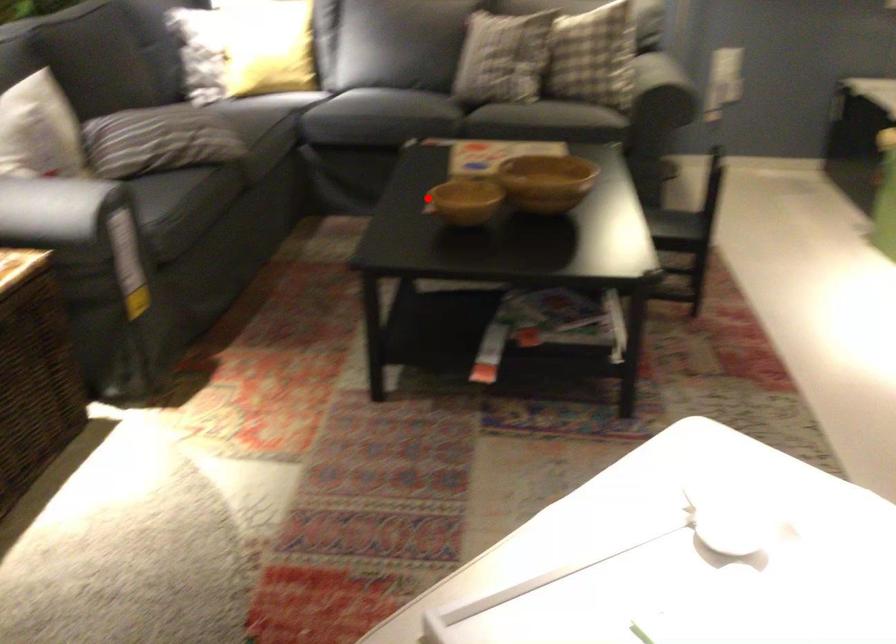
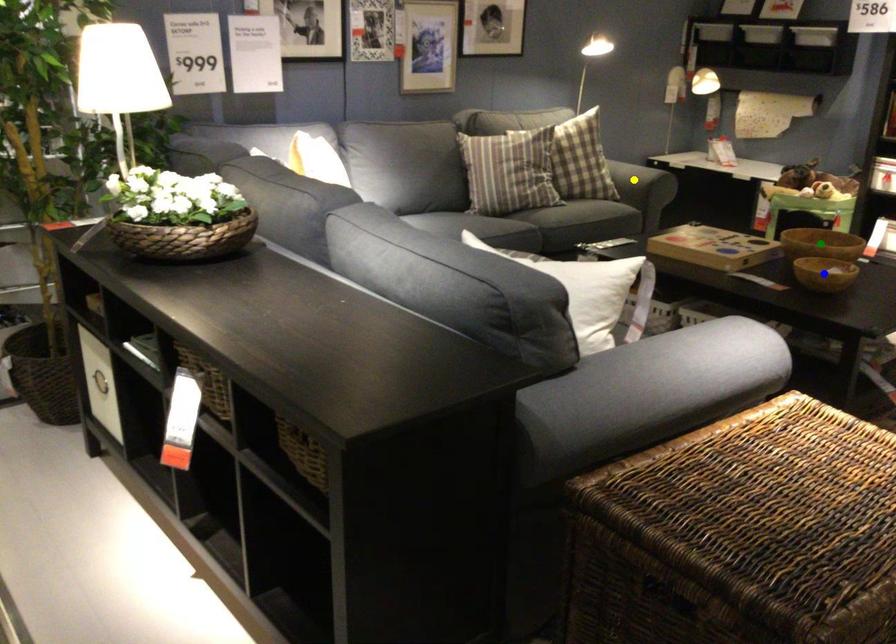
Question: I am providing you with two images of the same scene from different viewpoints. A red point is marked on the first image. You are given multiple points on the second image. In image 2, which mark is for the same physical point as the one in image 1?

Choices:
 (A) yellow point
 (B) blue point
 (C) green point

Answer: (B)